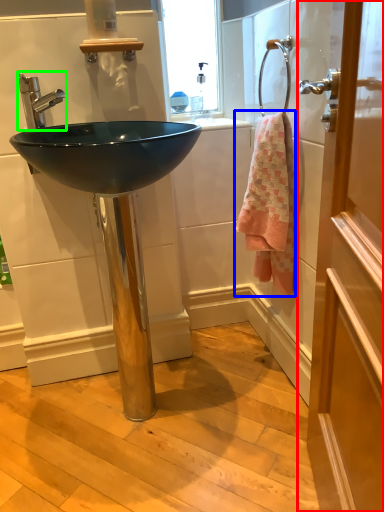
Question: Estimate the real-world distances between objects in this image. Which object is farther from door (highlighted by a red box), towel/napkin (highlighted by a blue box) or tap (highlighted by a green box)?

Choices:
 (A) towel/napkin
 (B) tap

Answer: (B)